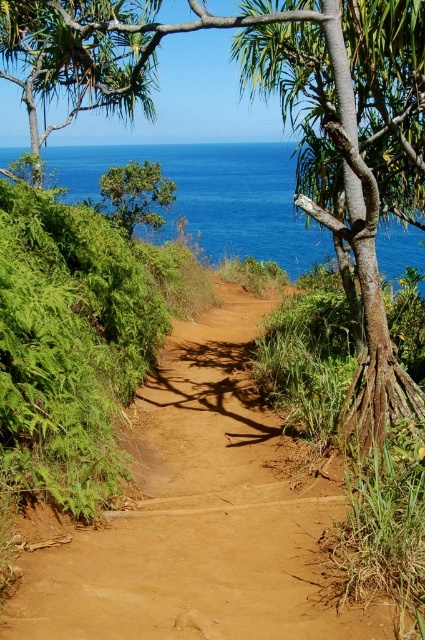
Question: Is blue water at upper center smaller than green leafy tree at upper left?

Choices:
 (A) no
 (B) yes

Answer: (B)

Question: Can you confirm if green leafy tree at center is smaller than green leafy tree at upper left?

Choices:
 (A) no
 (B) yes

Answer: (B)

Question: Which point appears farthest from the camera in this image?

Choices:
 (A) (357, 68)
 (B) (64, 182)
 (C) (152, 209)

Answer: (B)

Question: Which object is closer to the camera taking this photo?

Choices:
 (A) blue water at upper center
 (B) green leafy tree at upper left

Answer: (B)

Question: Which point is farther to the camera?

Choices:
 (A) green leafy tree at center
 (B) blue water at upper center
 (C) green leafy tree at upper left
 (D) brown dirt track at center

Answer: (B)

Question: Does brown dirt track at center have a lesser width compared to blue water at upper center?

Choices:
 (A) yes
 (B) no

Answer: (A)